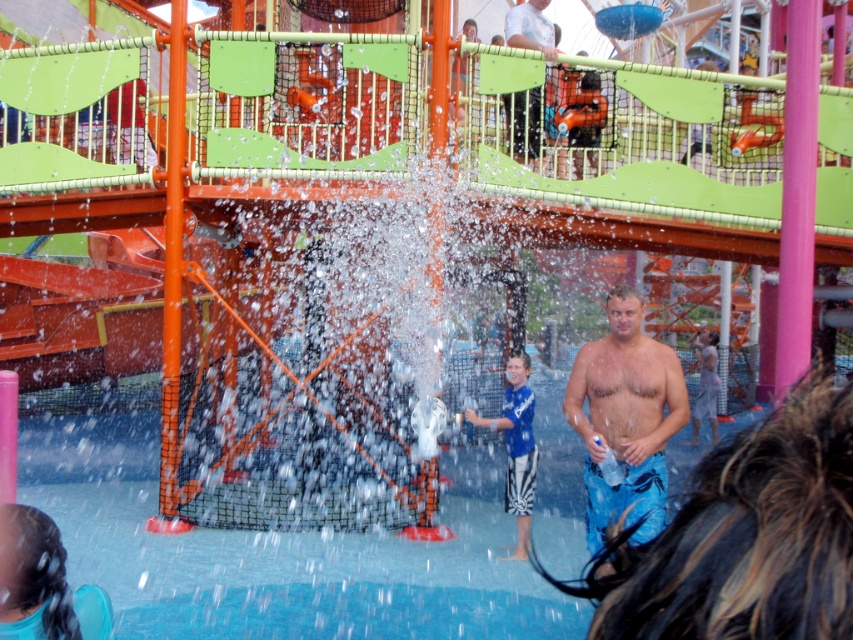
Question: Which object appears closest to the camera in this image?

Choices:
 (A) blue swim trunks at center
 (B) blue striped shorts at lower center

Answer: (A)

Question: Is blue swim trunks at center in front of blue striped shorts at center?

Choices:
 (A) yes
 (B) no

Answer: (A)

Question: Is blue swim trunks at center positioned behind blue striped shorts at lower center?

Choices:
 (A) yes
 (B) no

Answer: (B)

Question: Which is nearer to the blue fabric hair at lower left?

Choices:
 (A) blue rubber pool at center
 (B) smooth white shirt at upper center
 (C) blue striped shorts at center

Answer: (A)

Question: Among these objects, which one is nearest to the camera?

Choices:
 (A) blue striped shorts at center
 (B) blue rubber pool at center
 (C) blue striped shorts at lower center

Answer: (B)

Question: Observing the image, what is the correct spatial positioning of blue rubber pool at center in reference to blue striped shorts at lower center?

Choices:
 (A) above
 (B) below

Answer: (B)